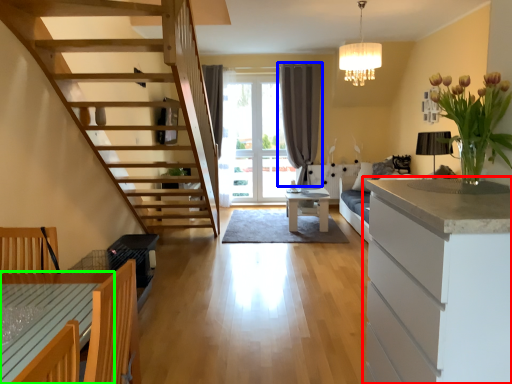
Question: Based on their relative distances, which object is nearer to cabinetry (highlighted by a red box)? Choose from curtain (highlighted by a blue box) and table (highlighted by a green box).

Choices:
 (A) curtain
 (B) table

Answer: (B)